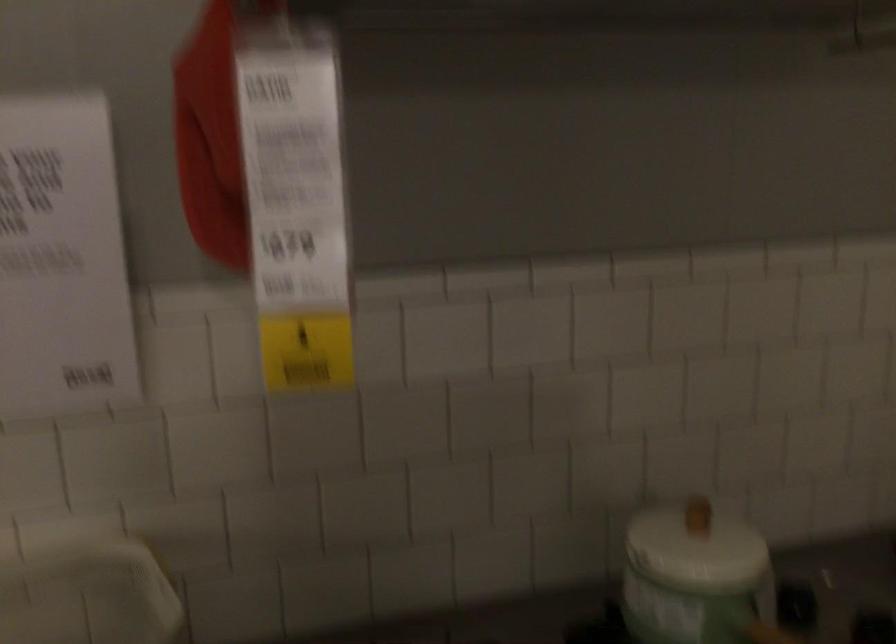
Where would you lift the small lid knob? Please return your answer as a coordinate pair (x, y).

(698, 516)